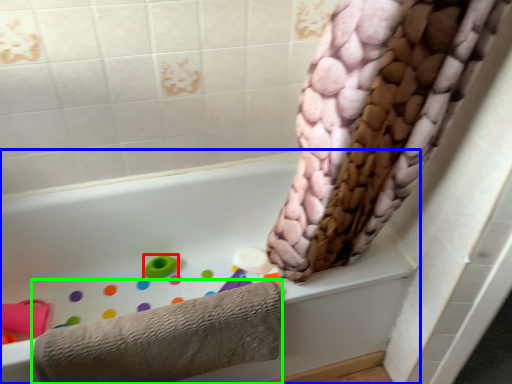
Question: Based on their relative distances, which object is farther from toy (highlighted by a red box)? Choose from bathtub (highlighted by a blue box) and towel (highlighted by a green box).

Choices:
 (A) bathtub
 (B) towel

Answer: (B)